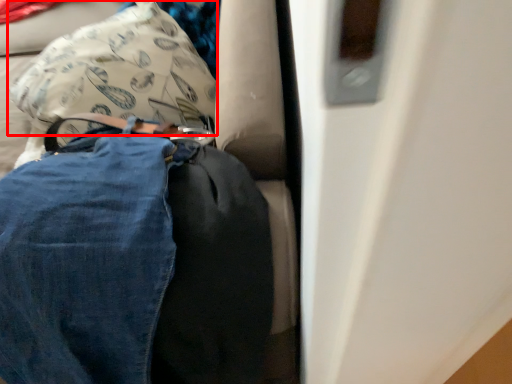
Question: Observing the image, what is the correct spatial positioning of pillow (annotated by the red box) in reference to trousers?

Choices:
 (A) right
 (B) left

Answer: (B)